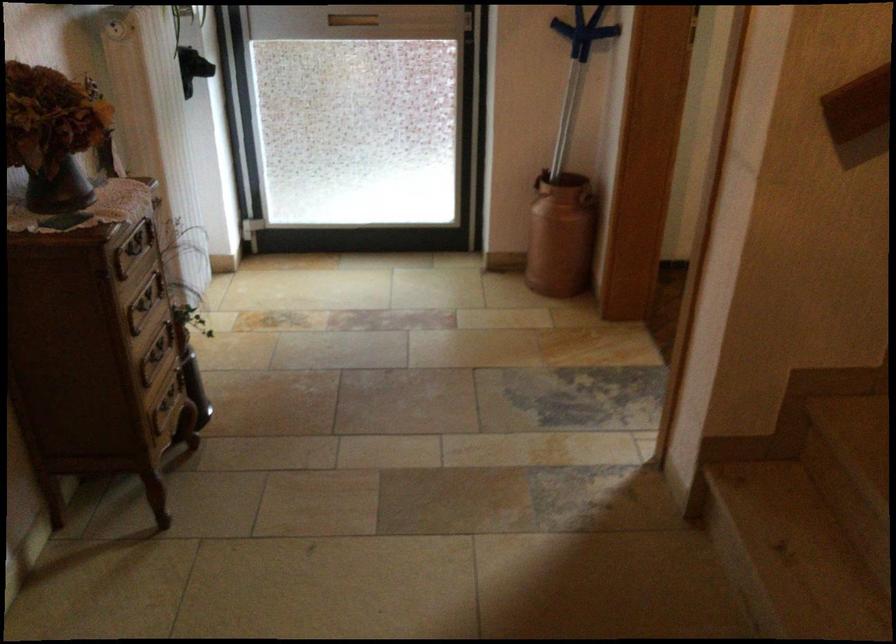
The location [53,134] corresponds to which object?

It corresponds to the dark vase in the image.